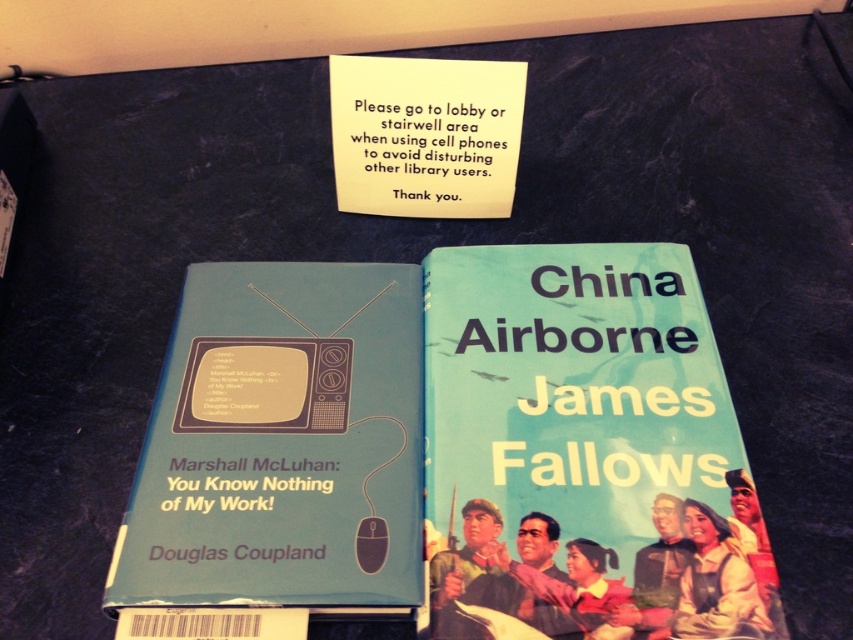
Question: Estimate the real-world distances between objects in this image. Which object is farther from the blue hardcover book at center?

Choices:
 (A) yellow paper at upper center
 (B) blue matte book at left

Answer: (A)

Question: Does blue hardcover book at center appear on the left side of yellow paper at upper center?

Choices:
 (A) yes
 (B) no

Answer: (B)

Question: Is blue hardcover book at center smaller than blue matte book at left?

Choices:
 (A) no
 (B) yes

Answer: (A)

Question: Which object is positioned farthest from the blue hardcover book at center?

Choices:
 (A) yellow paper at upper center
 (B) blue matte book at left

Answer: (A)

Question: Does blue hardcover book at center have a larger size compared to blue matte book at left?

Choices:
 (A) yes
 (B) no

Answer: (A)

Question: Which of the following is the farthest from the observer?

Choices:
 (A) yellow paper at upper center
 (B) blue hardcover book at center

Answer: (A)